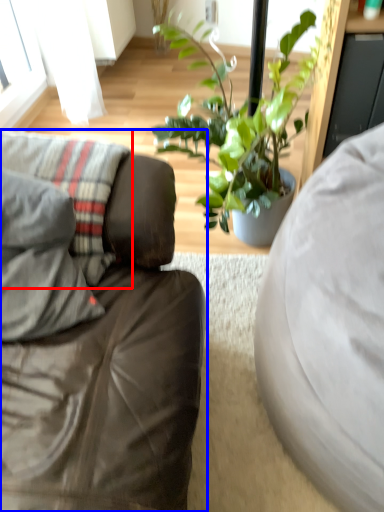
Question: Which of the following is the closest to the observer, pillow (highlighted by a red box) or studio couch (highlighted by a blue box)?

Choices:
 (A) pillow
 (B) studio couch

Answer: (B)